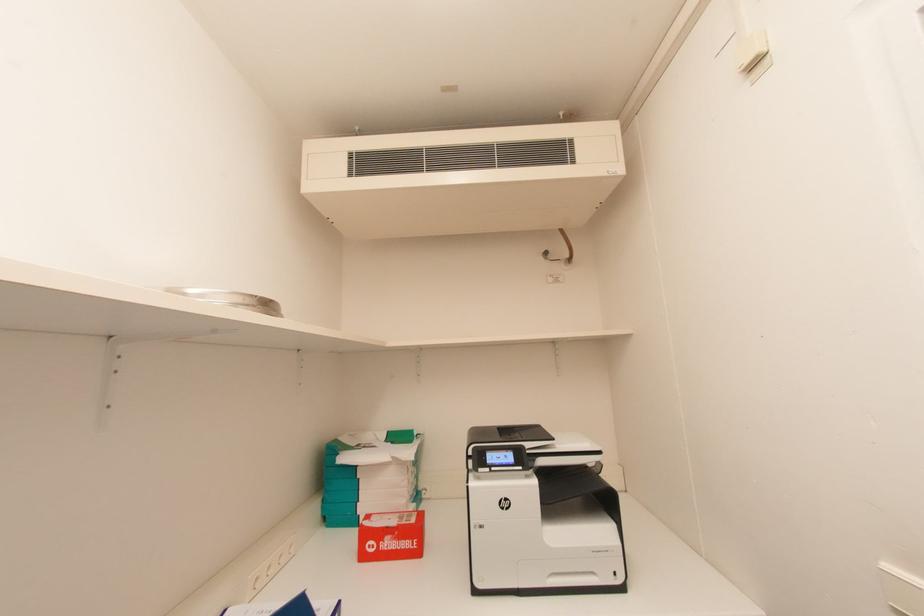
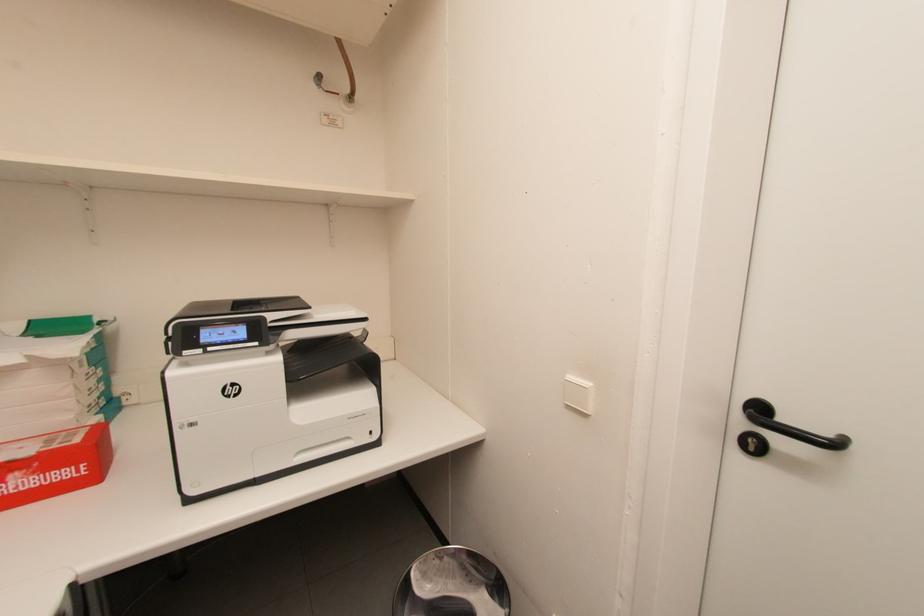
Based on the continuous images, in which direction is the camera rotating?

The camera rotated toward right-down.